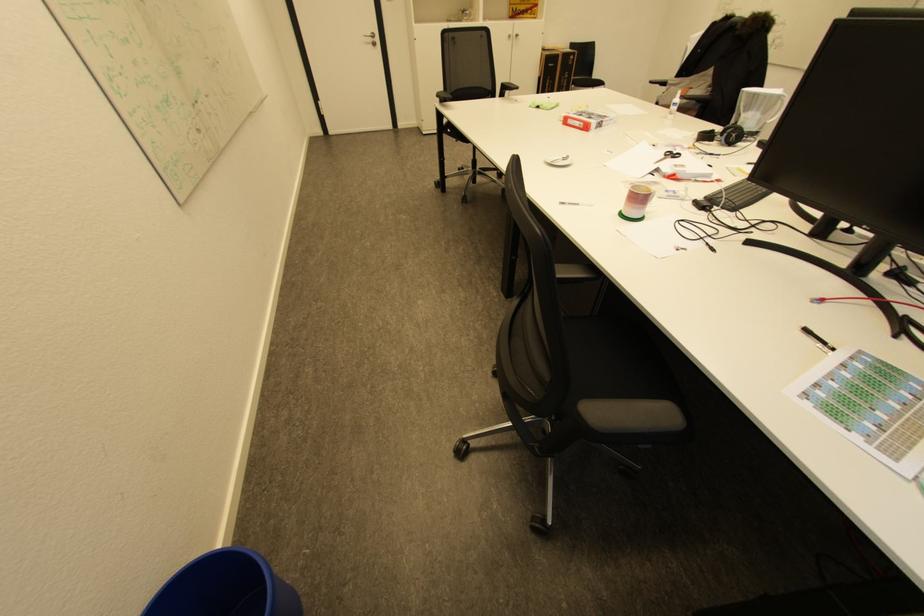
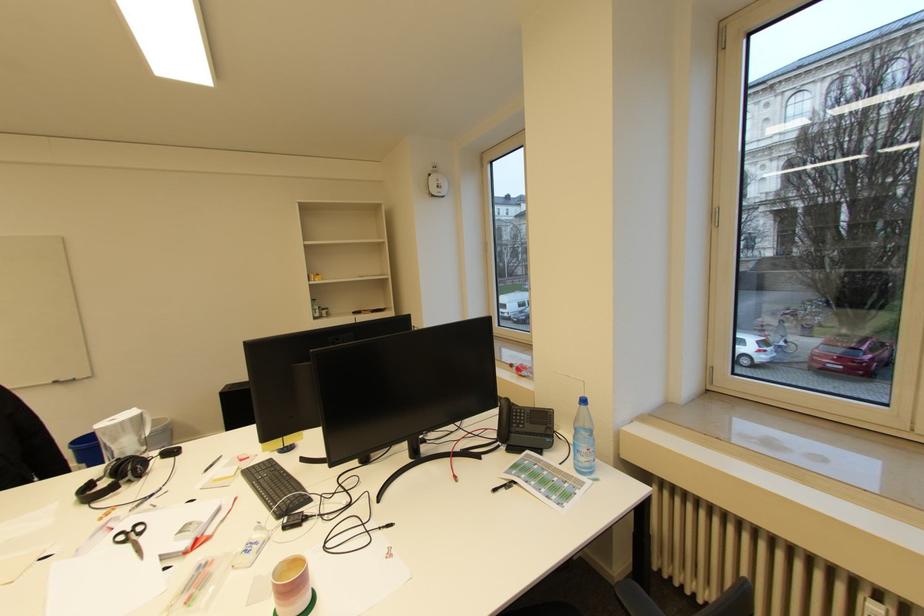
Locate, in the second image, the point that corresponds to [703,145] in the first image.

(100, 506)